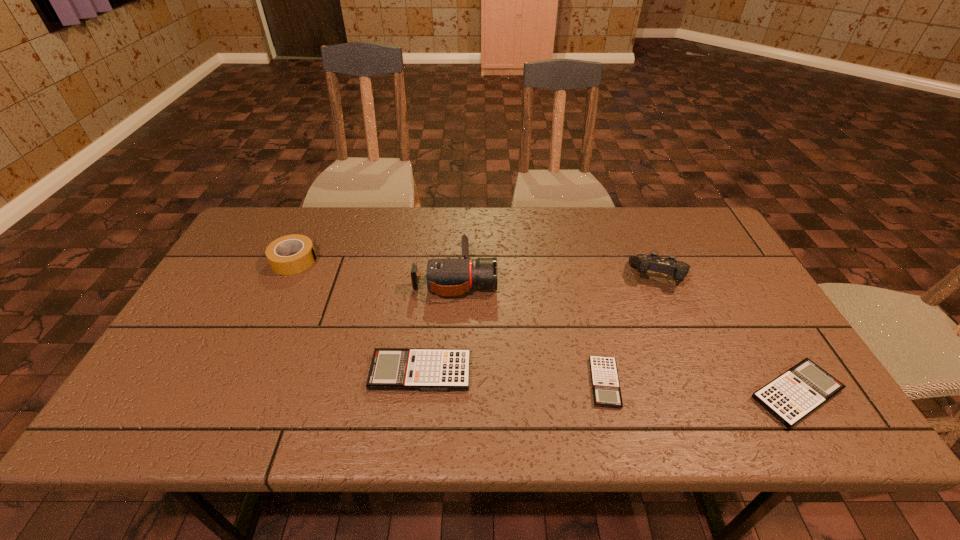
Where is `object located in the far left corner section of the desktop`? object located in the far left corner section of the desktop is located at coordinates (276, 252).

The width and height of the screenshot is (960, 540). In order to click on object situated at the near right corner in this screenshot , I will do `click(792, 396)`.

Locate an element on the screen. vacant space at the far edge is located at coordinates click(568, 248).

In the image, there is a desktop. Identify the location of vacant space at the near edge. Image resolution: width=960 pixels, height=540 pixels. (361, 389).

Where is `vacant area at the left edge`? This screenshot has height=540, width=960. vacant area at the left edge is located at coordinates (233, 258).

In order to click on free space at the right edge of the desktop in this screenshot , I will do point(765,354).

Locate an element on the screen. This screenshot has width=960, height=540. blank region between the camcorder and the second calculator from right to left is located at coordinates (530, 330).

I want to click on vacant area that lies between the control and the camcorder, so click(x=558, y=277).

This screenshot has width=960, height=540. In order to click on free spot between the fifth tallest object and the tallest object in this screenshot , I will do `click(626, 336)`.

Where is `vacant area that lies between the fourth object from left to right and the camcorder`? vacant area that lies between the fourth object from left to right and the camcorder is located at coordinates (530, 330).